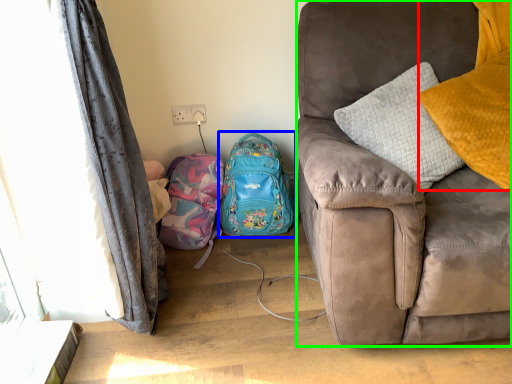
Question: Which is farther away from pillow (highlighted by a red box)? backpack (highlighted by a blue box) or studio couch (highlighted by a green box)?

Choices:
 (A) backpack
 (B) studio couch

Answer: (A)